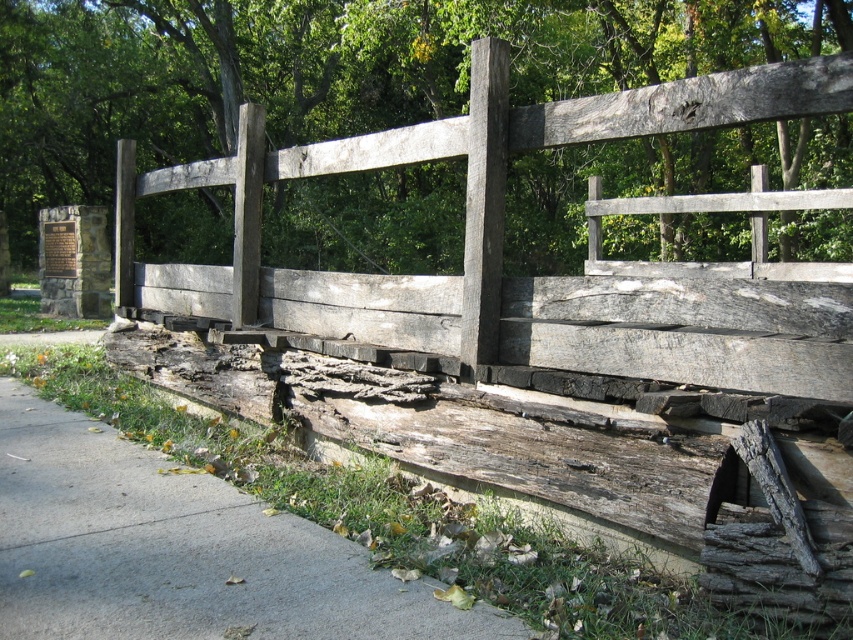
Can you confirm if gray concrete sidewalk at lower left is positioned below weathered wood fence at center?

Yes, gray concrete sidewalk at lower left is below weathered wood fence at center.

Does gray concrete sidewalk at lower left appear over weathered wood fence at center?

Incorrect, gray concrete sidewalk at lower left is not positioned above weathered wood fence at center.

Is point (201, 506) in front of point (469, 108)?

That is True.

Where is `gray concrete sidewalk at lower left`? Image resolution: width=853 pixels, height=640 pixels. gray concrete sidewalk at lower left is located at coordinates (180, 550).